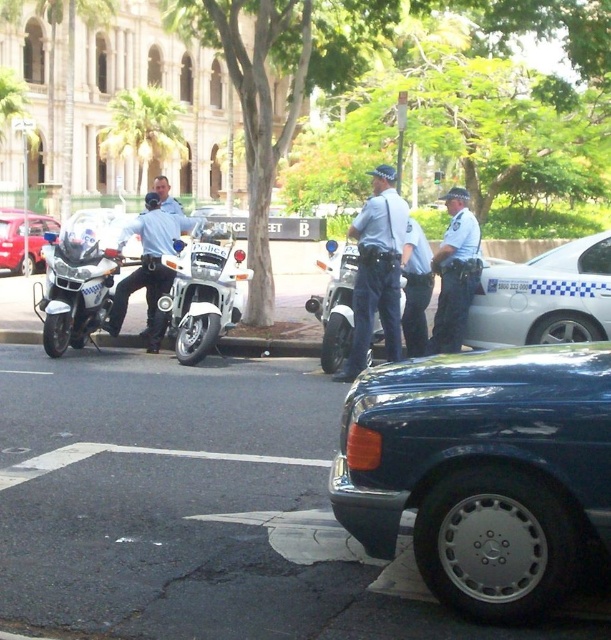
Can you confirm if polished chrome motorcycle at left is wider than light blue uniform at center?

Indeed, polished chrome motorcycle at left has a greater width compared to light blue uniform at center.

Can you confirm if polished chrome motorcycle at left is taller than light blue uniform at center?

Indeed, polished chrome motorcycle at left has a greater height compared to light blue uniform at center.

The image size is (611, 640). What do you see at coordinates (76, 280) in the screenshot?
I see `polished chrome motorcycle at left` at bounding box center [76, 280].

In order to click on polished chrome motorcycle at left in this screenshot , I will do [76, 280].

Between polished chrome motorcycle at left and metallic red sedan at left, which one appears on the right side from the viewer's perspective?

polished chrome motorcycle at left

Is point (45, 348) positioned in front of point (42, 244)?

That is True.

Describe the element at coordinates (76, 280) in the screenshot. I see `polished chrome motorcycle at left` at that location.

At what (x,y) coordinates should I click in order to perform the action: click on polished chrome motorcycle at left. Please return your answer as a coordinate pair (x, y). The width and height of the screenshot is (611, 640). Looking at the image, I should click on (76, 280).

Does metallic blue sedan at center appear on the left side of white glossy motorcycle at center?

In fact, metallic blue sedan at center is to the right of white glossy motorcycle at center.

Between metallic blue sedan at center and white glossy motorcycle at center, which one has less height?

white glossy motorcycle at center

Does point (538, 528) come behind point (191, 342)?

No, (538, 528) is in front of (191, 342).

The width and height of the screenshot is (611, 640). What are the coordinates of `metallic blue sedan at center` in the screenshot? It's located at (483, 472).